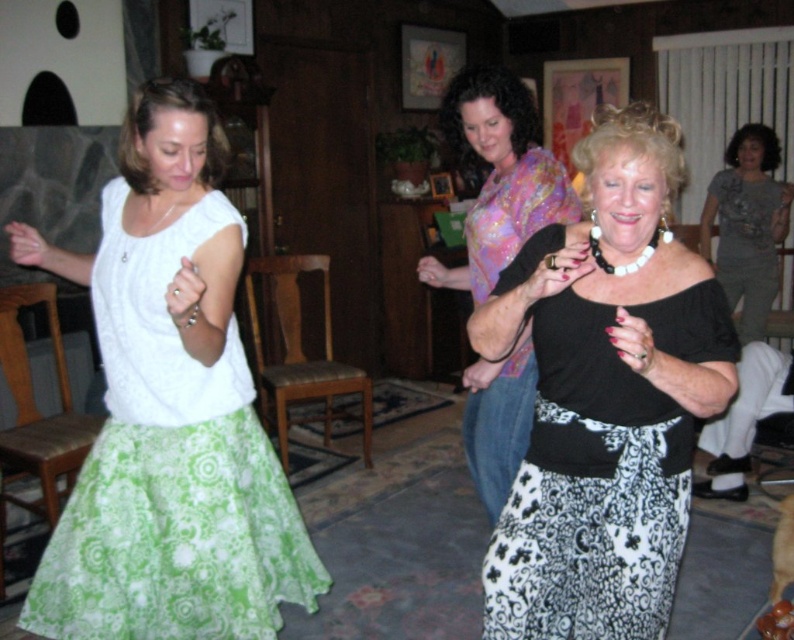
Question: Which point is farther to the camera?

Choices:
 (A) white lace blouse at left
 (B) black matte skirt at center

Answer: (A)

Question: Can you confirm if black matte skirt at center is positioned to the right of floral silk blouse at center?

Choices:
 (A) yes
 (B) no

Answer: (A)

Question: Does white lace blouse at left have a lesser width compared to floral silk blouse at center?

Choices:
 (A) yes
 (B) no

Answer: (B)

Question: Which point appears farthest from the camera in this image?

Choices:
 (A) (730, 193)
 (B) (482, 237)
 (C) (588, 374)
 (D) (293, 560)

Answer: (A)

Question: Can you confirm if white lace blouse at left is positioned above floral silk blouse at center?

Choices:
 (A) yes
 (B) no

Answer: (B)

Question: Which object is closer to the camera taking this photo?

Choices:
 (A) gray matte shirt at upper right
 (B) floral silk blouse at center
 (C) white lace blouse at left
 (D) black matte skirt at center

Answer: (D)